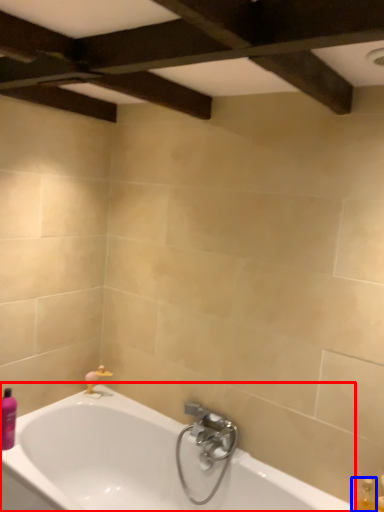
Question: Among these objects, which one is farthest to the camera, bathtub (highlighted by a red box) or bottle (highlighted by a blue box)?

Choices:
 (A) bathtub
 (B) bottle

Answer: (B)